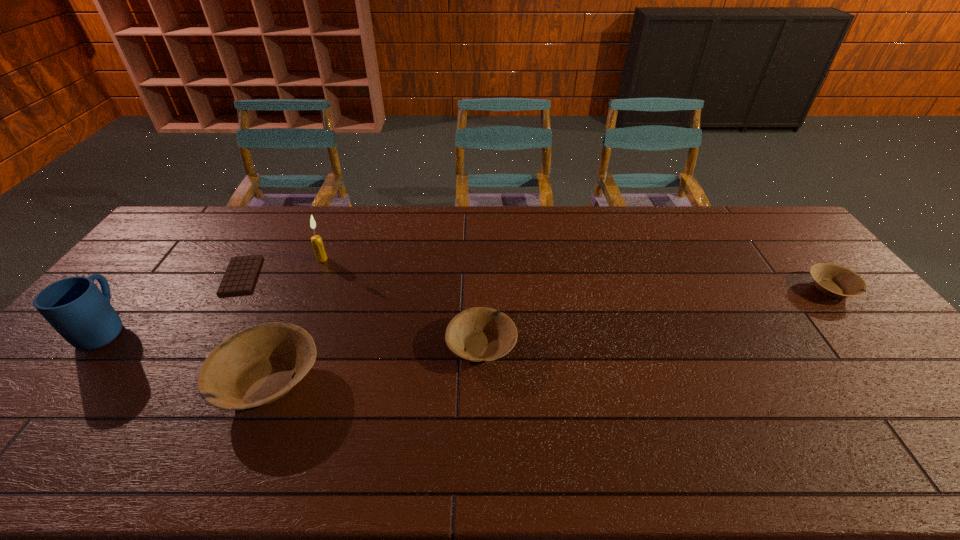
In order to click on spot to insert another bowl for uniform distribution in this screenshot , I will do `click(667, 316)`.